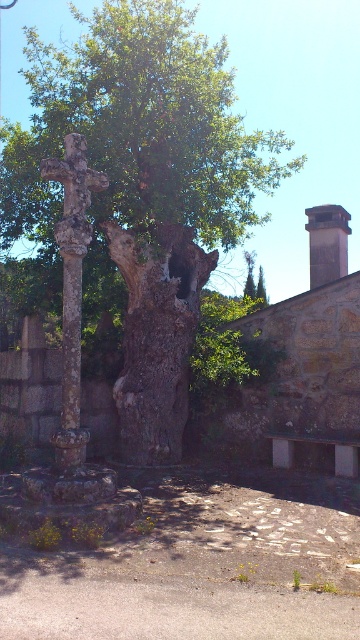
Question: Which is nearer to the smooth brown tree trunk at center?

Choices:
 (A) stone cross at left
 (B) smooth gray chimney at upper right

Answer: (B)

Question: Is the position of smooth brown tree trunk at center less distant than that of stone cross at left?

Choices:
 (A) no
 (B) yes

Answer: (A)

Question: Does smooth brown tree trunk at center come in front of stone cross at left?

Choices:
 (A) no
 (B) yes

Answer: (A)

Question: Which point is closer to the camera taking this photo?

Choices:
 (A) (154, 64)
 (B) (83, 216)
 (C) (124, 275)

Answer: (B)

Question: Is smooth brown tree trunk at center positioned at the back of smooth gray chimney at upper right?

Choices:
 (A) yes
 (B) no

Answer: (B)

Question: Which is nearer to the smooth gray chimney at upper right?

Choices:
 (A) green rough bark tree at center
 (B) stone cross at left

Answer: (A)